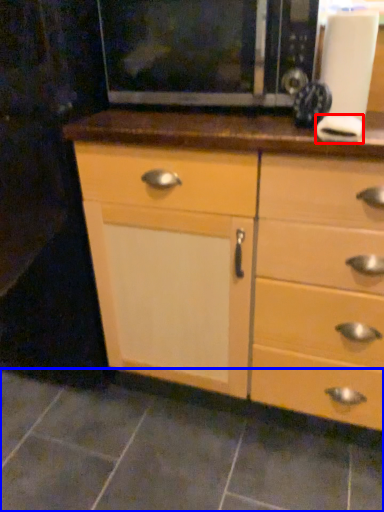
Question: Which of the following is the closest to the observer, knob (highlighted by a red box) or tile (highlighted by a blue box)?

Choices:
 (A) knob
 (B) tile

Answer: (A)